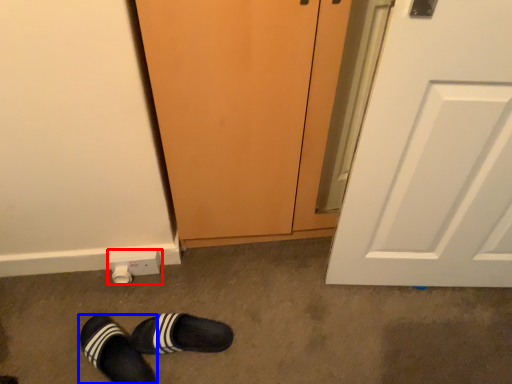
Question: Which point is further to the camera, electric outlet (highlighted by a red box) or footwear (highlighted by a blue box)?

Choices:
 (A) electric outlet
 (B) footwear

Answer: (A)